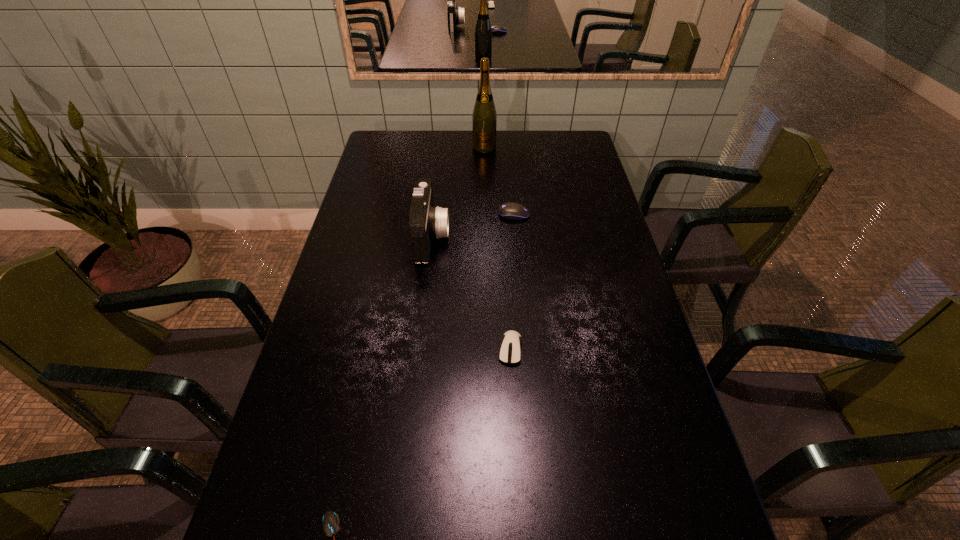
Identify the location of object at the far edge. (484, 119).

Where is `vacant space at the far edge of the desktop`? This screenshot has width=960, height=540. vacant space at the far edge of the desktop is located at coordinates (461, 131).

You are a GUI agent. You are given a task and a screenshot of the screen. Output one action in this format:
    pyautogui.click(x=<x>, y=<y>)
    Task: Click on the vacant space at the left edge of the desktop
    
    Given the screenshot: What is the action you would take?
    pyautogui.click(x=319, y=304)

Where is `free spot at the right edge of the desktop`? free spot at the right edge of the desktop is located at coordinates (588, 186).

This screenshot has width=960, height=540. I want to click on unoccupied area between the farthest mouse and the second farthest mouse, so click(x=513, y=282).

I want to click on vacant point located between the tallest object and the farthest mouse, so click(499, 181).

You are a GUI agent. You are given a task and a screenshot of the screen. Output one action in this format:
    pyautogui.click(x=<x>, y=<y>)
    Task: Click on the free space that is in between the farthest mouse and the fourth farthest object
    
    Given the screenshot: What is the action you would take?
    pyautogui.click(x=513, y=282)

Identify the location of free spot between the second nearest mouse and the farthest mouse. (513, 282).

Where is `free space between the farthest mouse and the fourth farthest object`? free space between the farthest mouse and the fourth farthest object is located at coordinates (513, 282).

You are a GUI agent. You are given a task and a screenshot of the screen. Output one action in this format:
    pyautogui.click(x=<x>, y=<y>)
    Task: Click on the object that is the second closest to the fourth farthest object
    
    Given the screenshot: What is the action you would take?
    pyautogui.click(x=331, y=521)